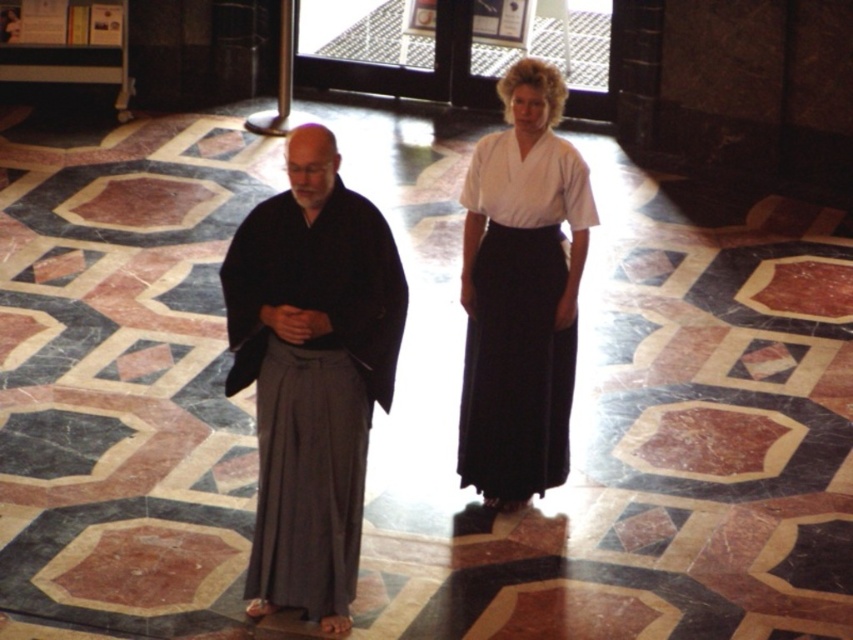
You are a photographer setting up a shoot in this room. You need to position the black silk kimono at center and white cotton kimono at center so that they are aligned with the hexagonal tiles on the floor. Given the current arrangement, which kimono is closer to the left side of the hexagonal tiles?

The black silk kimono at center is positioned to the left of the white cotton kimono at center, so it is closer to the left side of the hexagonal tiles.

You are a tailor observing two kimonos displayed at center in a room with a geometric floor pattern. Which kimono, the dark gray fabric kimono at center or the white cotton kimono at center, is shorter in height?

The dark gray fabric kimono at center is shorter in height compared to the white cotton kimono at center.

You are a photographer trying to capture a clear shot of the dark gray fabric kimono at center and the black silk kimono at center. Since both are at the center, which one do you need to focus on first to ensure the other is also in focus?

The dark gray fabric kimono at center is in front of the black silk kimono at center, so focusing on the dark gray fabric kimono at center will ensure the black silk kimono at center is also in focus.